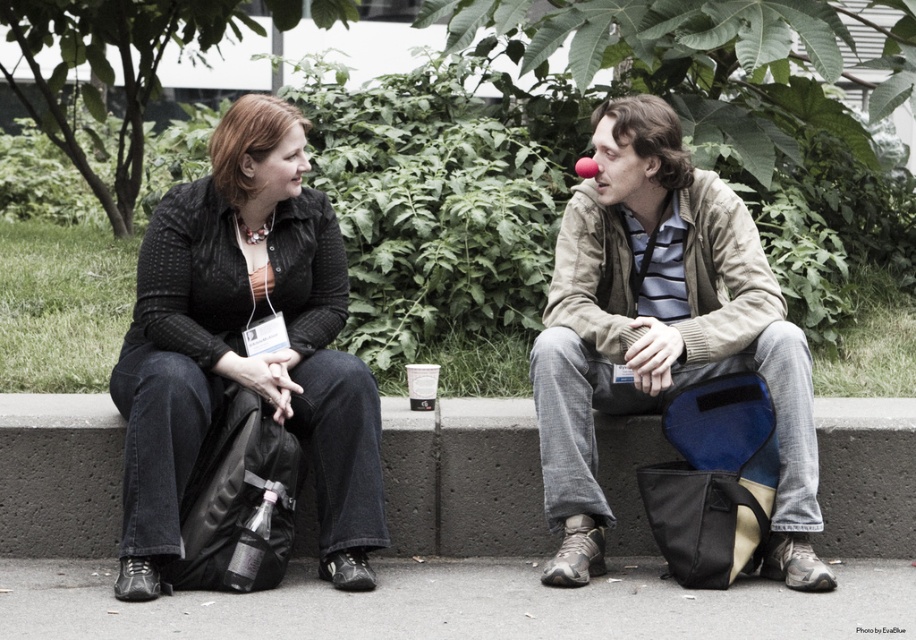
Question: Which object appears farthest from the camera in this image?

Choices:
 (A) light beige jacket at center
 (B) matte black jacket at center

Answer: (A)

Question: Which of the following is the closest to the observer?

Choices:
 (A) light beige jacket at center
 (B) matte black sweater at center

Answer: (B)

Question: Can you confirm if matte black sweater at center is wider than light beige jacket at center?

Choices:
 (A) no
 (B) yes

Answer: (A)

Question: Which of these objects is positioned closest to the matte black jacket at center?

Choices:
 (A) matte black sweater at center
 (B) light beige jacket at center

Answer: (B)

Question: Where is matte black jacket at center located in relation to matte black sweater at center in the image?

Choices:
 (A) below
 (B) above

Answer: (A)

Question: Can you confirm if matte black jacket at center is thinner than matte black sweater at center?

Choices:
 (A) yes
 (B) no

Answer: (A)